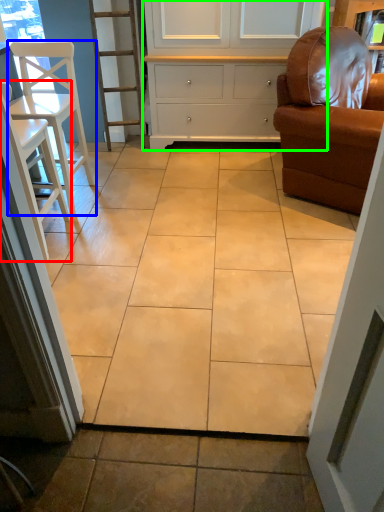
Question: Which object is positioned farthest from chair (highlighted by a red box)? Select from chair (highlighted by a blue box) and cabinetry (highlighted by a green box).

Choices:
 (A) chair
 (B) cabinetry

Answer: (B)